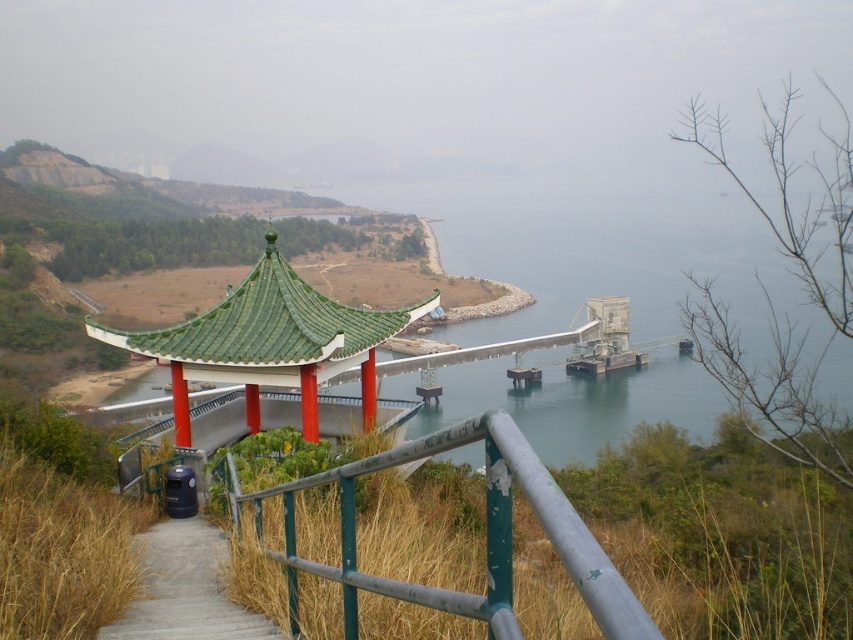
You are a tour guide leading a group to the pavilion. You need to ensure that a wheelchair can pass through the green painted metal railing at center and the wooden stairs at lower left. Which of these two has a wider path for the wheelchair to navigate?

The green painted metal railing at center has a greater width than the wooden stairs at lower left, so the wheelchair can navigate through the green painted metal railing at center more easily.

Based on the photo, you are standing at the entrance of the pavilion and want to take a photo of the two points marked in the image. Which point, point (604, 621) or point (114, 336), is closer to your current position?

Point (604, 621) is closer to the camera than point (114, 336), so it is closer to your current position at the pavilion entrance.

You are standing at the base of the wooden stairs at lower left and want to reach the green painted metal railing at center. Which direction should you head towards?

You should head towards the right to reach the green painted metal railing at center from the wooden stairs at lower left, as the green painted metal railing at center is located to the right of the wooden stairs at lower left.